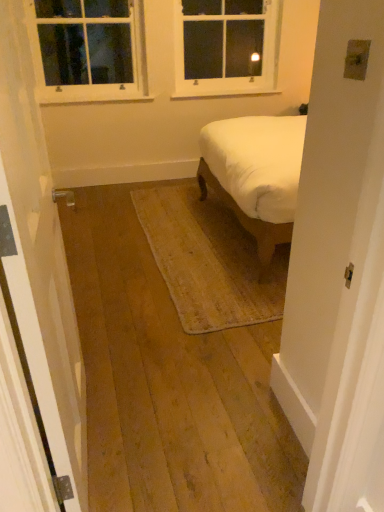
What do you see at coordinates (40, 259) in the screenshot? The height and width of the screenshot is (512, 384). I see `white wooden door at left` at bounding box center [40, 259].

At what (x,y) coordinates should I click in order to perform the action: click on white glass window at upper center, which is counted as the first window, starting from the right. Please return your answer as a coordinate pair (x, y). Looking at the image, I should click on pos(225,47).

Which object is positioned more to the left, white painted wood window at upper left, acting as the second window starting from the right, or white glass window at upper center, which is counted as the first window, starting from the right?

From the viewer's perspective, white painted wood window at upper left, acting as the second window starting from the right, appears more on the left side.

Considering the sizes of white painted wood window at upper left, which appears as the first window when viewed from the left, and white glass window at upper center, which is the second window from left to right, in the image, is white painted wood window at upper left, which appears as the first window when viewed from the left, taller or shorter than white glass window at upper center, which is the second window from left to right,?

Clearly, white painted wood window at upper left, which appears as the first window when viewed from the left, is shorter compared to white glass window at upper center, which is the second window from left to right.

From the picture: From a real-world perspective, who is located higher, white painted wood window at upper left, acting as the second window starting from the right, or white glass window at upper center, which is the second window from left to right?

white painted wood window at upper left, acting as the second window starting from the right.

Which object is positioned more to the left, white wooden door at left or white glass window at upper center, which is the second window from left to right?

Positioned to the left is white wooden door at left.

Considering the sizes of white wooden door at left and white glass window at upper center, which is the second window from left to right, in the image, is white wooden door at left bigger or smaller than white glass window at upper center, which is the second window from left to right,?

Considering their sizes, white wooden door at left takes up more space than white glass window at upper center, which is the second window from left to right.

Is point (43, 342) in front of point (219, 46)?

Yes, point (43, 342) is in front of point (219, 46).

From the image's perspective, is white glass window at upper center, which is the second window from left to right, above or below white wooden door at left?

white glass window at upper center, which is the second window from left to right, is situated higher than white wooden door at left in the image.

Does point (267, 20) come in front of point (59, 281)?

No, (267, 20) is behind (59, 281).

How distant is white glass window at upper center, which is counted as the first window, starting from the right, from white wooden door at left?

The distance of white glass window at upper center, which is counted as the first window, starting from the right, from white wooden door at left is 3.06 meters.

Does white glass window at upper center, which is the second window from left to right, have a greater height compared to white wooden door at left?

In fact, white glass window at upper center, which is the second window from left to right, may be shorter than white wooden door at left.

Is white glass window at upper center, which is the second window from left to right, oriented away from white painted wood window at upper left, which appears as the first window when viewed from the left?

No.

In terms of height, does white glass window at upper center, which is the second window from left to right, look taller or shorter compared to white painted wood window at upper left, which appears as the first window when viewed from the left?

Considering their sizes, white glass window at upper center, which is the second window from left to right, has more height than white painted wood window at upper left, which appears as the first window when viewed from the left.

Is white glass window at upper center, which is the second window from left to right, at the left side of white painted wood window at upper left, which appears as the first window when viewed from the left?

In fact, white glass window at upper center, which is the second window from left to right, is to the right of white painted wood window at upper left, which appears as the first window when viewed from the left.

Between white glass window at upper center, which is the second window from left to right, and white painted wood window at upper left, acting as the second window starting from the right, which one has smaller width?

Thinner between the two is white painted wood window at upper left, acting as the second window starting from the right.

Is white painted wood window at upper left, which appears as the first window when viewed from the left, thinner than white wooden door at left?

No.

Consider the image. Can you see white painted wood window at upper left, which appears as the first window when viewed from the left, touching white wooden door at left?

No, white painted wood window at upper left, which appears as the first window when viewed from the left, is not next to white wooden door at left.

This screenshot has width=384, height=512. What are the coordinates of `door in front of the white painted wood window at upper left, acting as the second window starting from the right` in the screenshot? It's located at (40, 259).

Is white painted wood window at upper left, acting as the second window starting from the right, located outside white wooden door at left?

Yes, white painted wood window at upper left, acting as the second window starting from the right, is outside of white wooden door at left.

Based on their sizes in the image, would you say white wooden door at left is bigger or smaller than white painted wood window at upper left, acting as the second window starting from the right?

Clearly, white wooden door at left is larger in size than white painted wood window at upper left, acting as the second window starting from the right.

Is white wooden door at left not inside white painted wood window at upper left, which appears as the first window when viewed from the left?

Indeed, white wooden door at left is completely outside white painted wood window at upper left, which appears as the first window when viewed from the left.

Is white wooden door at left taller or shorter than white painted wood window at upper left, acting as the second window starting from the right?

Clearly, white wooden door at left is taller compared to white painted wood window at upper left, acting as the second window starting from the right.

Is white wooden door at left far from white painted wood window at upper left, which appears as the first window when viewed from the left?

Indeed, white wooden door at left is not near white painted wood window at upper left, which appears as the first window when viewed from the left.

You are a GUI agent. You are given a task and a screenshot of the screen. Output one action in this format:
    pyautogui.click(x=<x>, y=<y>)
    Task: Click on the window located below the white glass window at upper center, which is counted as the first window, starting from the right (from the image's perspective)
    
    Given the screenshot: What is the action you would take?
    pyautogui.click(x=89, y=50)

This screenshot has height=512, width=384. Find the location of `door on the left of white glass window at upper center, which is the second window from left to right`. door on the left of white glass window at upper center, which is the second window from left to right is located at coordinates (40, 259).

When comparing their distances from white wooden door at left, does white painted wood window at upper left, which appears as the first window when viewed from the left, or white glass window at upper center, which is counted as the first window, starting from the right, seem closer?

white painted wood window at upper left, which appears as the first window when viewed from the left, is positioned closer to the anchor white wooden door at left.

In the scene shown: Estimate the real-world distances between objects in this image. Which object is closer to white painted wood window at upper left, which appears as the first window when viewed from the left, white wooden door at left or white glass window at upper center, which is counted as the first window, starting from the right?

The object closer to white painted wood window at upper left, which appears as the first window when viewed from the left, is white glass window at upper center, which is counted as the first window, starting from the right.

Considering their positions, is white painted wood window at upper left, acting as the second window starting from the right, positioned closer to white glass window at upper center, which is counted as the first window, starting from the right, than white wooden door at left?

Among the two, white painted wood window at upper left, acting as the second window starting from the right, is located nearer to white glass window at upper center, which is counted as the first window, starting from the right.

Consider the image. When comparing their distances from white wooden door at left, does white glass window at upper center, which is counted as the first window, starting from the right, or white painted wood window at upper left, which appears as the first window when viewed from the left, seem further?

Based on the image, white glass window at upper center, which is counted as the first window, starting from the right, appears to be further to white wooden door at left.

Considering their positions, is white glass window at upper center, which is the second window from left to right, positioned closer to white painted wood window at upper left, acting as the second window starting from the right, than white wooden door at left?

white glass window at upper center, which is the second window from left to right, is closer to white painted wood window at upper left, acting as the second window starting from the right.

When comparing their distances from white glass window at upper center, which is the second window from left to right, does white wooden door at left or white painted wood window at upper left, acting as the second window starting from the right, seem further?

The object further to white glass window at upper center, which is the second window from left to right, is white wooden door at left.

Where is `window positioned between white wooden door at left and white glass window at upper center, which is counted as the first window, starting from the right, from near to far`? The height and width of the screenshot is (512, 384). window positioned between white wooden door at left and white glass window at upper center, which is counted as the first window, starting from the right, from near to far is located at coordinates (89, 50).